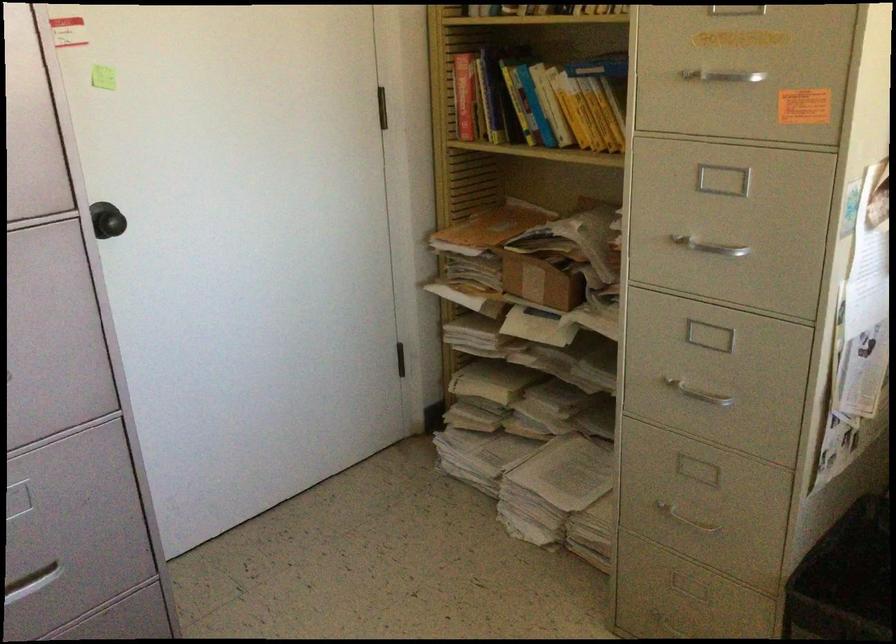
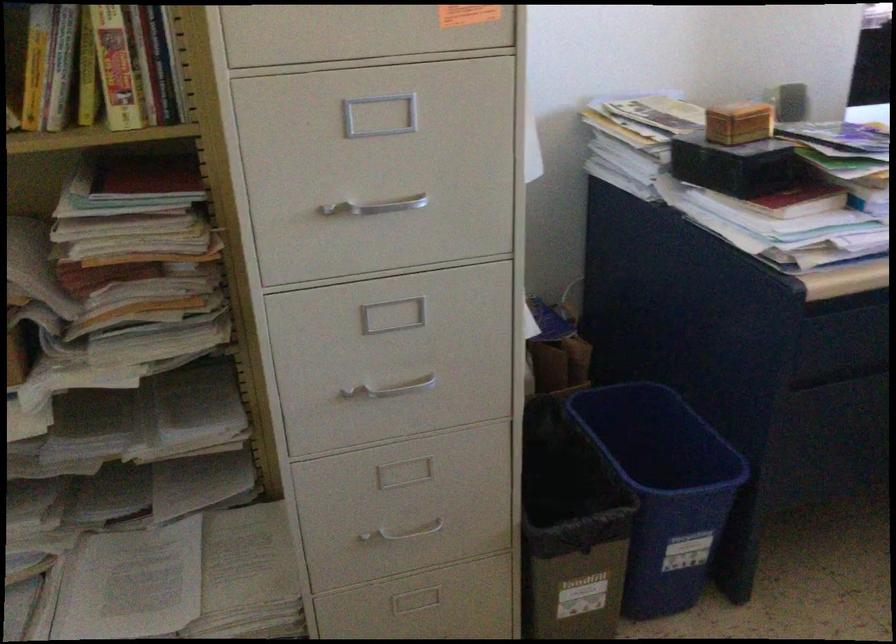
Question: The camera is either moving clockwise (left) or counter-clockwise (right) around the object. The first image is from the beginning of the video and the second image is from the end. Is the camera moving left or right when shooting the video?

Choices:
 (A) Left
 (B) Right

Answer: (A)